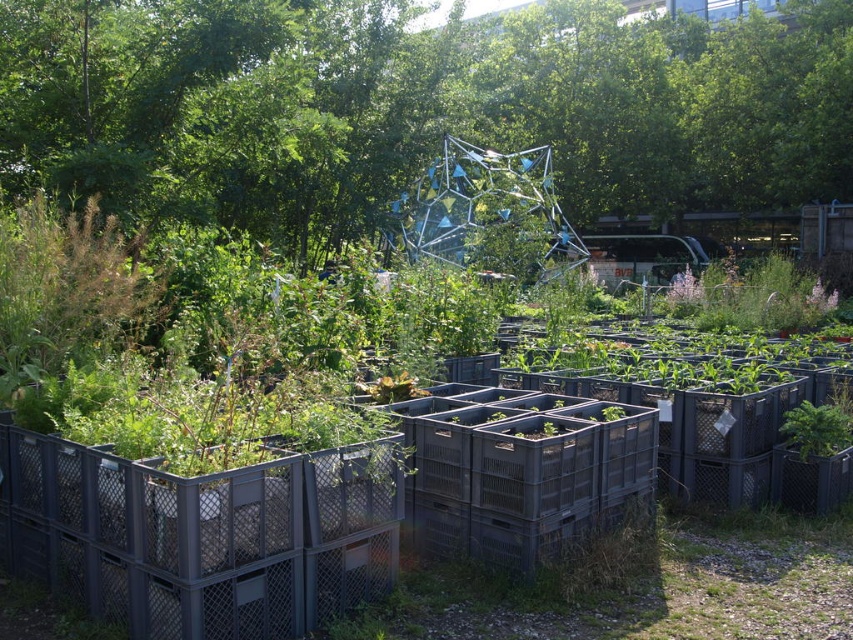
You are a gardener who needs to prune the green leafy tree at center and check the plants in the gray plastic crates at center. Which task should you do first if you want to work from the tallest object to the shortest?

You should prune the green leafy tree at center first because it is much taller than the gray plastic crates at center.